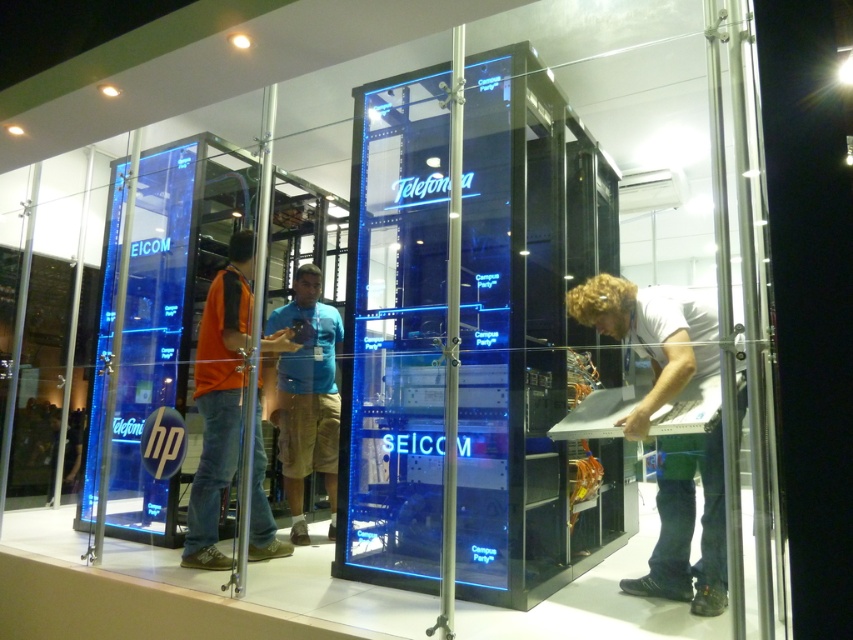
Question: Is orange fabric shirt at center bigger than blue fabric shirt at center?

Choices:
 (A) no
 (B) yes

Answer: (A)

Question: Which of the following is the closest to the observer?

Choices:
 (A) (726, 582)
 (B) (264, 397)

Answer: (A)

Question: Which of the following is the closest to the observer?

Choices:
 (A) white matte shirt at center
 (B) blue fabric shirt at center

Answer: (A)

Question: Can you confirm if orange fabric shirt at center is positioned to the right of blue fabric shirt at center?

Choices:
 (A) no
 (B) yes

Answer: (A)

Question: Is white matte shirt at center bigger than blue fabric shirt at center?

Choices:
 (A) no
 (B) yes

Answer: (B)

Question: Which of these objects is positioned farthest from the orange fabric shirt at center?

Choices:
 (A) blue fabric shirt at center
 (B) white matte shirt at center

Answer: (B)